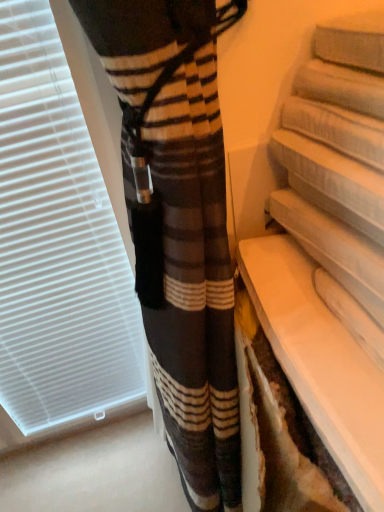
Question: Is white plastic window blind at left to the left or to the right of white glossy shelf at lower right in the image?

Choices:
 (A) right
 (B) left

Answer: (B)

Question: Is white plastic window blind at left situated inside white glossy shelf at lower right or outside?

Choices:
 (A) outside
 (B) inside

Answer: (A)

Question: From a real-world perspective, is white plastic window blind at left above or below white glossy shelf at lower right?

Choices:
 (A) below
 (B) above

Answer: (A)

Question: Is white glossy shelf at lower right situated inside white plastic window blind at left or outside?

Choices:
 (A) inside
 (B) outside

Answer: (B)

Question: Is point (326, 364) positioned closer to the camera than point (13, 243)?

Choices:
 (A) farther
 (B) closer

Answer: (B)

Question: From the image's perspective, is white glossy shelf at lower right positioned above or below white plastic window blind at left?

Choices:
 (A) above
 (B) below

Answer: (B)

Question: Would you say white glossy shelf at lower right is to the left or to the right of white plastic window blind at left in the picture?

Choices:
 (A) right
 (B) left

Answer: (A)